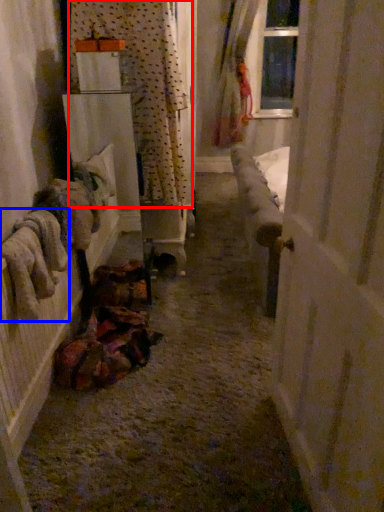
Question: Which point is further to the camera, curtain (highlighted by a red box) or clothing (highlighted by a blue box)?

Choices:
 (A) curtain
 (B) clothing

Answer: (A)